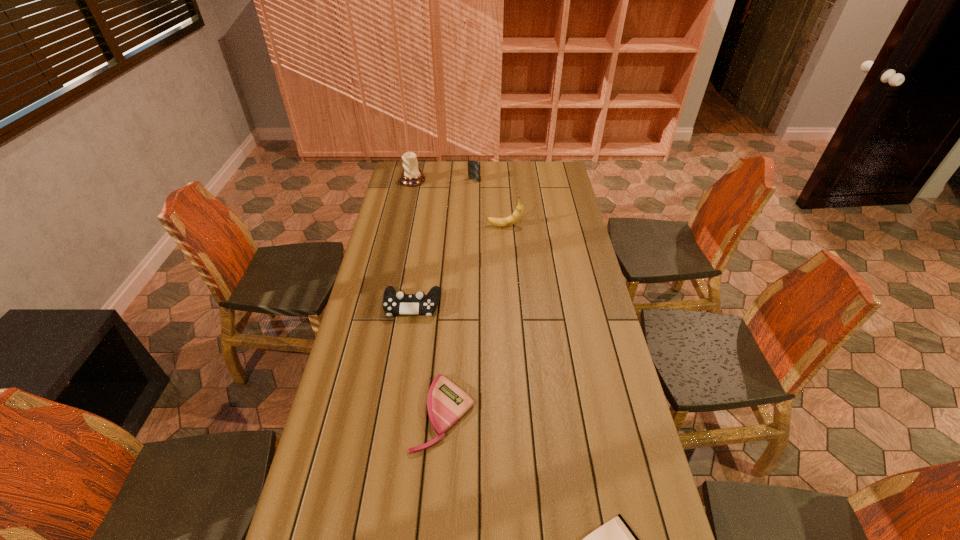
Identify the location of candle holder. (411, 176).

Find the location of a particular element. Image resolution: width=960 pixels, height=540 pixels. the fourth nearest object is located at coordinates (517, 214).

Identify the location of cellular telephone. Image resolution: width=960 pixels, height=540 pixels. (473, 166).

Find the location of `the fourth farthest object`. the fourth farthest object is located at coordinates (394, 303).

This screenshot has width=960, height=540. In order to click on control in this screenshot , I will do `click(394, 303)`.

I want to click on the fifth farthest object, so click(x=447, y=403).

Find the location of `vacant space located on the front of the candle holder`. vacant space located on the front of the candle holder is located at coordinates (408, 202).

Where is `free space located 0.220m at the start of the peel on the third farthest object`? This screenshot has height=540, width=960. free space located 0.220m at the start of the peel on the third farthest object is located at coordinates (x=437, y=226).

This screenshot has height=540, width=960. Identify the location of free location located at the start of the peel on the third farthest object. (460, 226).

Identify the location of vacant space located at the start of the peel on the third farthest object. (421, 226).